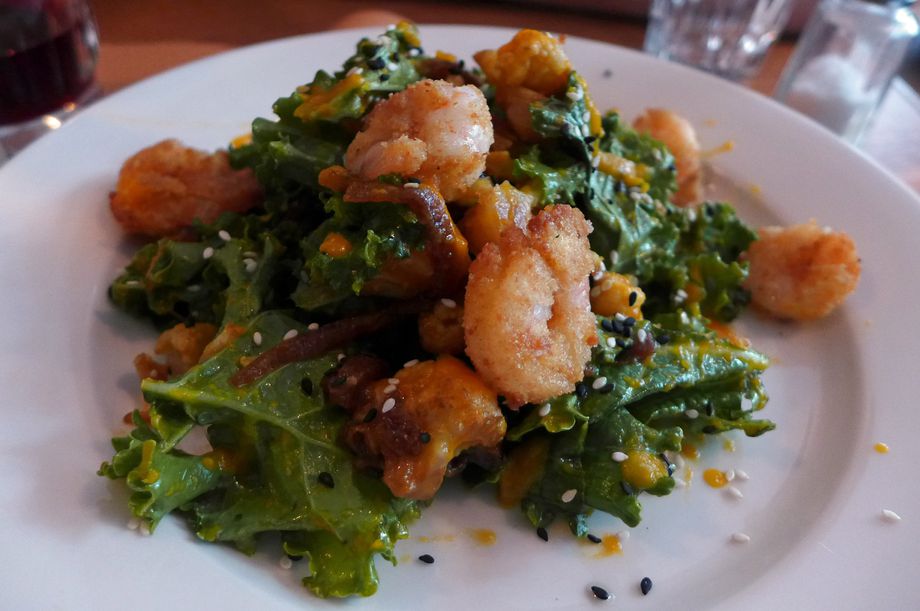
I want to click on food on plate, so click(x=541, y=166).